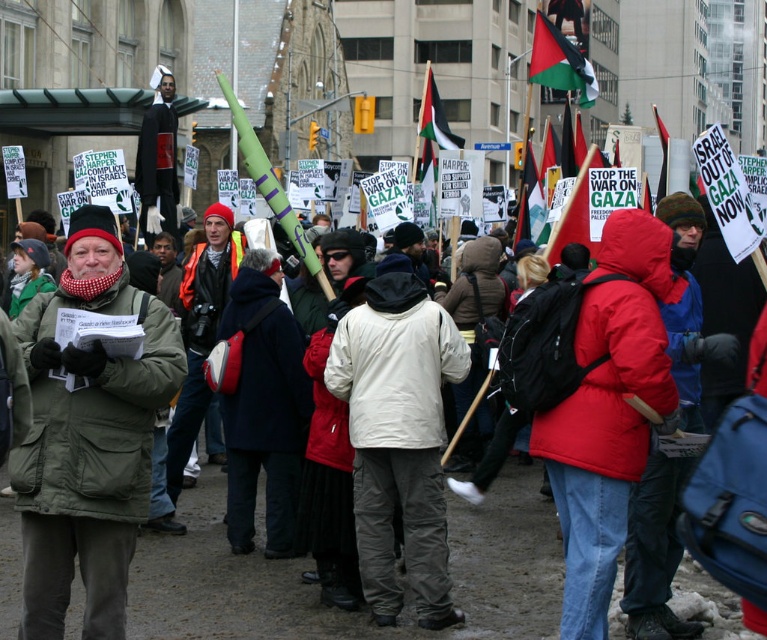
Question: Which point is closer to the camera?

Choices:
 (A) (443, 344)
 (B) (637, 368)
 (C) (545, 52)
 (D) (33, 497)

Answer: (D)

Question: Observing the image, what is the correct spatial positioning of green matte jacket at center in reference to palestinian flag at upper center?

Choices:
 (A) above
 (B) below

Answer: (B)

Question: Based on their relative distances, which object is farther from the matte red jacket at center?

Choices:
 (A) green matte jacket at center
 (B) white matte jacket at center
 (C) palestinian flag at upper center

Answer: (C)

Question: Does white matte jacket at center lie in front of palestinian flag at upper center?

Choices:
 (A) yes
 (B) no

Answer: (A)

Question: Which object is closer to the camera taking this photo?

Choices:
 (A) matte red jacket at center
 (B) palestinian flag at upper center
 (C) white matte jacket at center

Answer: (A)

Question: Does matte red jacket at center have a lesser width compared to white matte jacket at center?

Choices:
 (A) yes
 (B) no

Answer: (A)